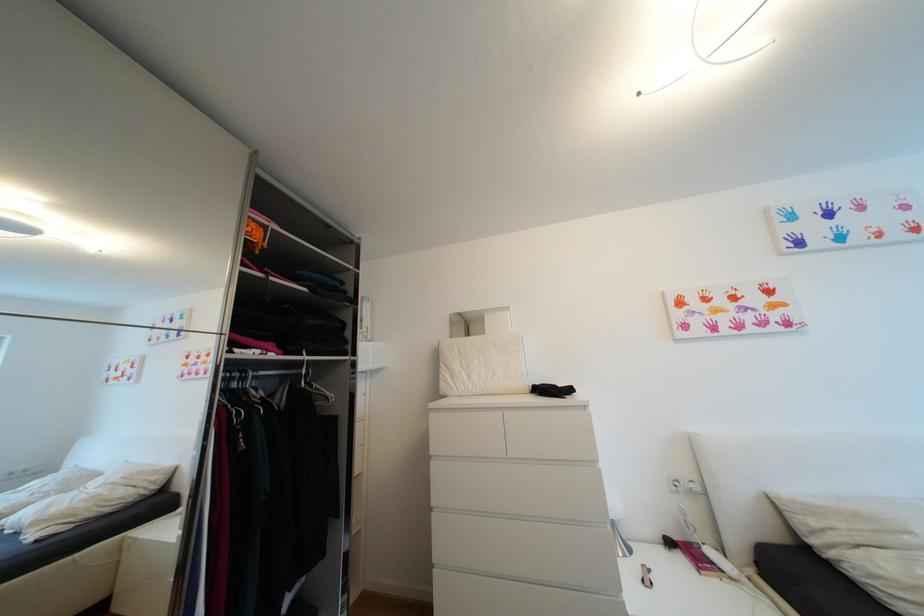
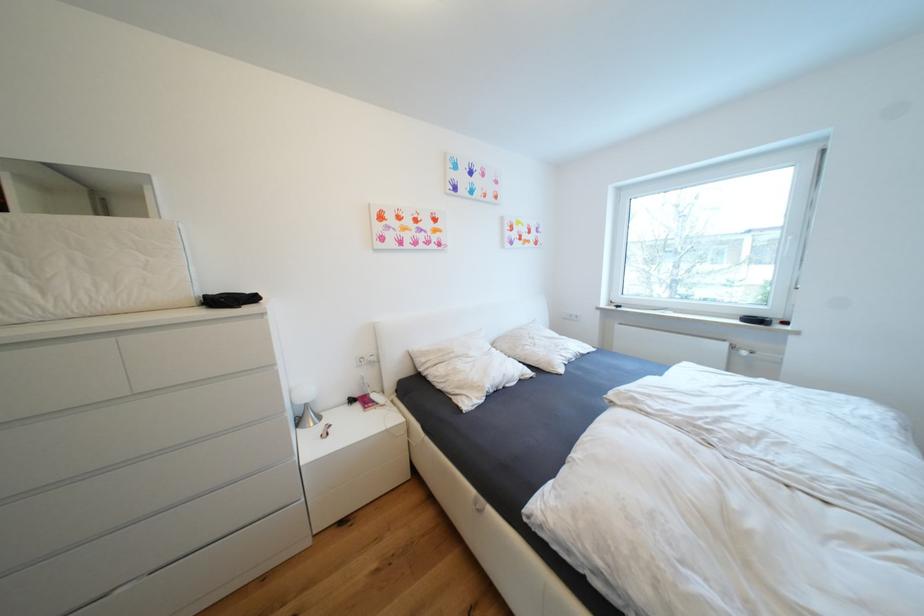
Locate, in the second image, the point that corresponds to pixel 544 384 in the first image.

(222, 294)